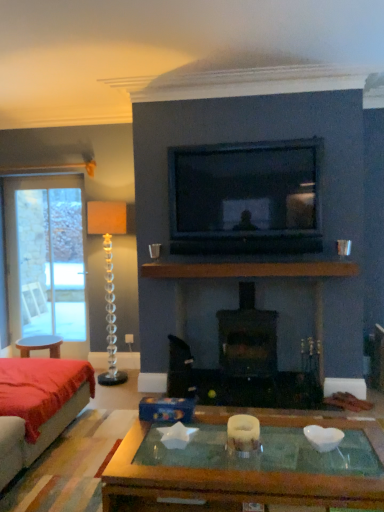
Question: From the image's perspective, is velvet red couch at lower left located beneath clear glass candle holder at left, which is counted as the 2th candle holder, starting from the right?

Choices:
 (A) yes
 (B) no

Answer: (A)

Question: Is clear glass candle holder at left, the 2th candle holder positioned from the front, a part of velvet red couch at lower left?

Choices:
 (A) yes
 (B) no

Answer: (B)

Question: Considering the relative positions of velvet red couch at lower left and clear glass candle holder at left, which is counted as the 2th candle holder, starting from the right, in the image provided, is velvet red couch at lower left to the right of clear glass candle holder at left, which is counted as the 2th candle holder, starting from the right, from the viewer's perspective?

Choices:
 (A) no
 (B) yes

Answer: (A)

Question: Is velvet red couch at lower left in front of clear glass candle holder at left, the second candle holder when ordered from bottom to top?

Choices:
 (A) yes
 (B) no

Answer: (A)

Question: Does velvet red couch at lower left turn towards clear glass candle holder at left, which is counted as the 2th candle holder, starting from the right?

Choices:
 (A) yes
 (B) no

Answer: (B)

Question: Is brown wooden mantle at center taller or shorter than velvet red couch at lower left?

Choices:
 (A) short
 (B) tall

Answer: (A)

Question: Is brown wooden mantle at center wider or thinner than velvet red couch at lower left?

Choices:
 (A) wide
 (B) thin

Answer: (B)

Question: From the image's perspective, relative to velvet red couch at lower left, is brown wooden mantle at center above or below?

Choices:
 (A) above
 (B) below

Answer: (A)

Question: Is brown wooden mantle at center in front of or behind velvet red couch at lower left in the image?

Choices:
 (A) behind
 (B) front

Answer: (A)

Question: Considering the positions of point (64, 214) and point (327, 273), is point (64, 214) closer or farther from the camera than point (327, 273)?

Choices:
 (A) farther
 (B) closer

Answer: (A)

Question: Looking at their shapes, would you say clear glass screen door at left is wider or thinner than brown wooden mantle at center?

Choices:
 (A) wide
 (B) thin

Answer: (B)

Question: From a real-world perspective, is clear glass screen door at left positioned above or below brown wooden mantle at center?

Choices:
 (A) below
 (B) above

Answer: (A)

Question: Considering their positions, is clear glass screen door at left located in front of or behind brown wooden mantle at center?

Choices:
 (A) front
 (B) behind

Answer: (B)

Question: Is brown wooden mantle at center taller or shorter than silver metallic cup at center?

Choices:
 (A) tall
 (B) short

Answer: (B)

Question: From the image's perspective, is brown wooden mantle at center above or below silver metallic cup at center?

Choices:
 (A) below
 (B) above

Answer: (A)